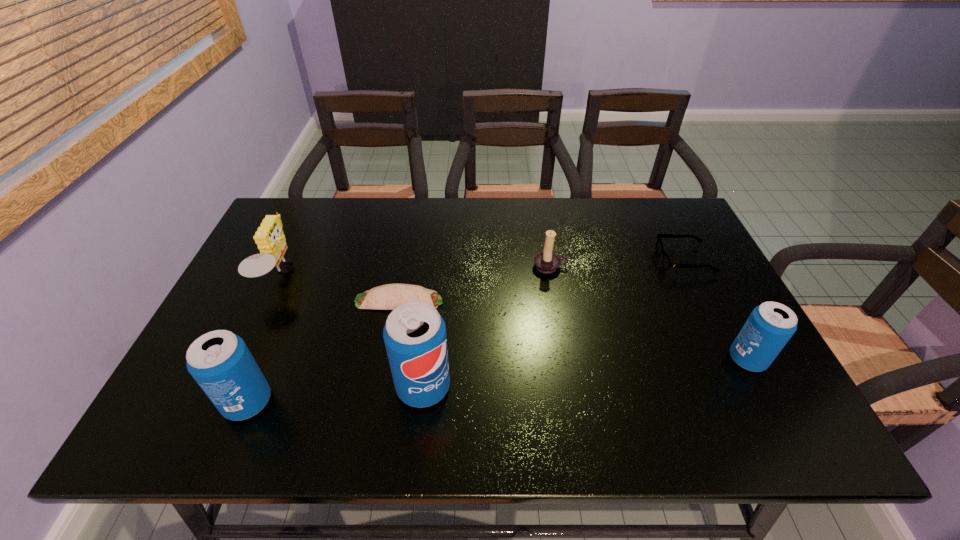
Locate an element on the screen. Image resolution: width=960 pixels, height=540 pixels. vacant area that lies between the second soda can from left to right and the third object from right to left is located at coordinates (487, 327).

Identify the location of vacant area that lies between the shortest soda can and the sixth shortest object. The width and height of the screenshot is (960, 540). (497, 381).

Identify the location of vacant point located between the spectacles and the second soda can from right to left. (554, 324).

At what (x,y) coordinates should I click in order to perform the action: click on vacant area that lies between the fifth object from left to right and the shortest object. Please return your answer as a coordinate pair (x, y). Looking at the image, I should click on [x=474, y=284].

Find the location of `vacant area that lies between the sponge and the leftmost soda can`. vacant area that lies between the sponge and the leftmost soda can is located at coordinates (263, 339).

I want to click on vacant region between the fifth object from left to right and the shortest soda can, so click(x=649, y=313).

Identify the location of unoccupied position between the sponge and the shortest soda can. The height and width of the screenshot is (540, 960). (x=514, y=317).

Find the location of a particular element. The image size is (960, 540). free point between the sponge and the shortest object is located at coordinates (339, 288).

Identify the location of the second closest object to the leftmost soda can. (390, 296).

Identify which object is the closest to the second shortest object. Please provide its 2D coordinates. Your answer should be formatted as a tuple, i.e. [(x, y)], where the tuple contains the x and y coordinates of a point satisfying the conditions above.

[(769, 327)]